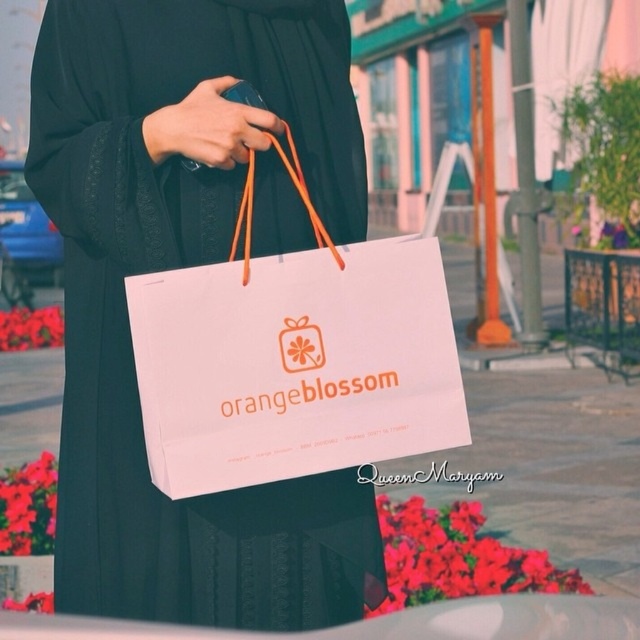
Question: Among these points, which one is farthest from the camera?

Choices:
 (A) (198, 481)
 (B) (240, 604)

Answer: (B)

Question: Which of the following is the closest to the observer?

Choices:
 (A) white paper bag at center
 (B) black matte robe at center

Answer: (A)

Question: Is black matte robe at center wider than white paper bag at center?

Choices:
 (A) no
 (B) yes

Answer: (B)

Question: Which object is farther from the camera taking this photo?

Choices:
 (A) black matte robe at center
 (B) white paper bag at center

Answer: (A)

Question: Can you confirm if black matte robe at center is positioned below white paper bag at center?

Choices:
 (A) no
 (B) yes

Answer: (B)

Question: Does black matte robe at center have a greater width compared to white paper bag at center?

Choices:
 (A) no
 (B) yes

Answer: (B)